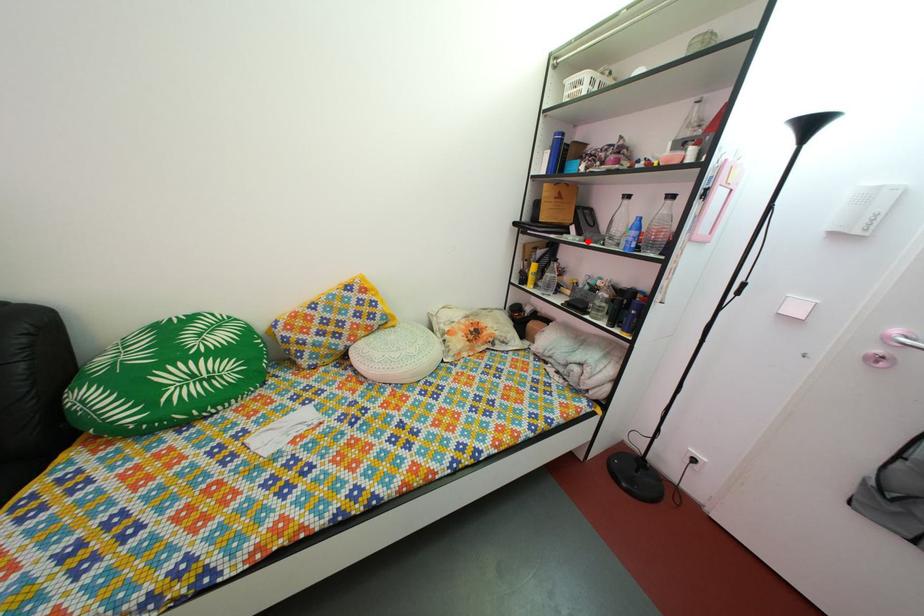
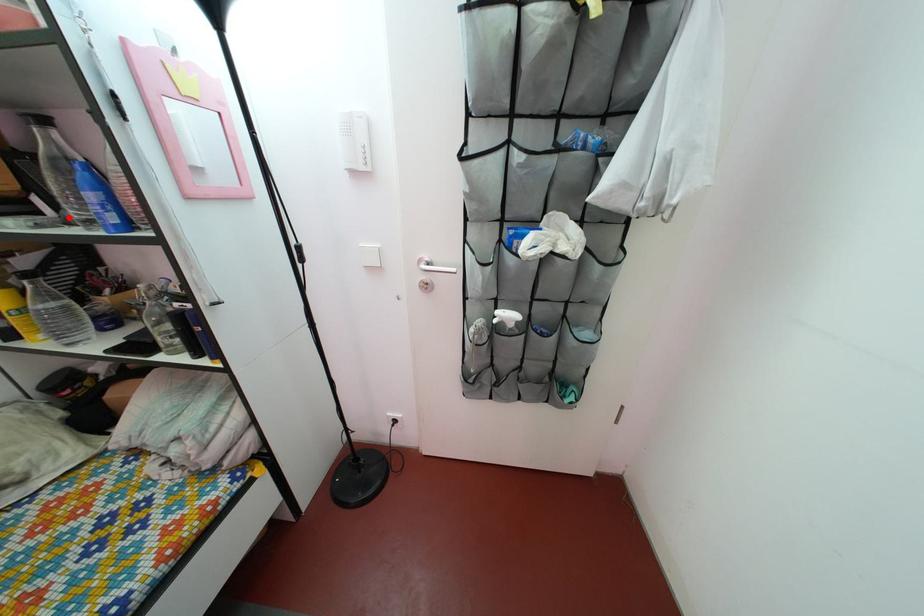
I am providing you with two images of the same scene from different viewpoints. A red point is marked on the first image and another point is marked on the second image. Does the point marked in image1 correspond to the same location as the one in image2?

Yes